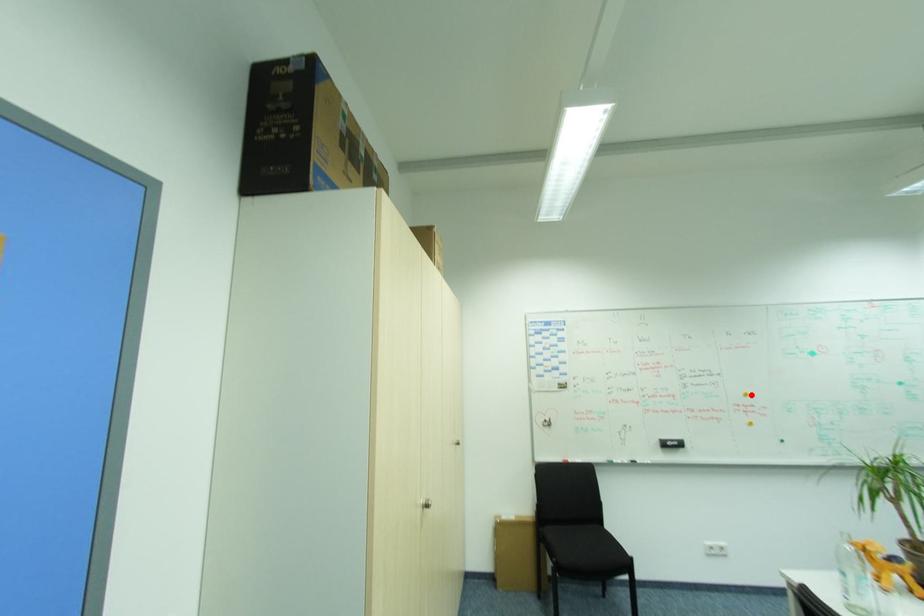
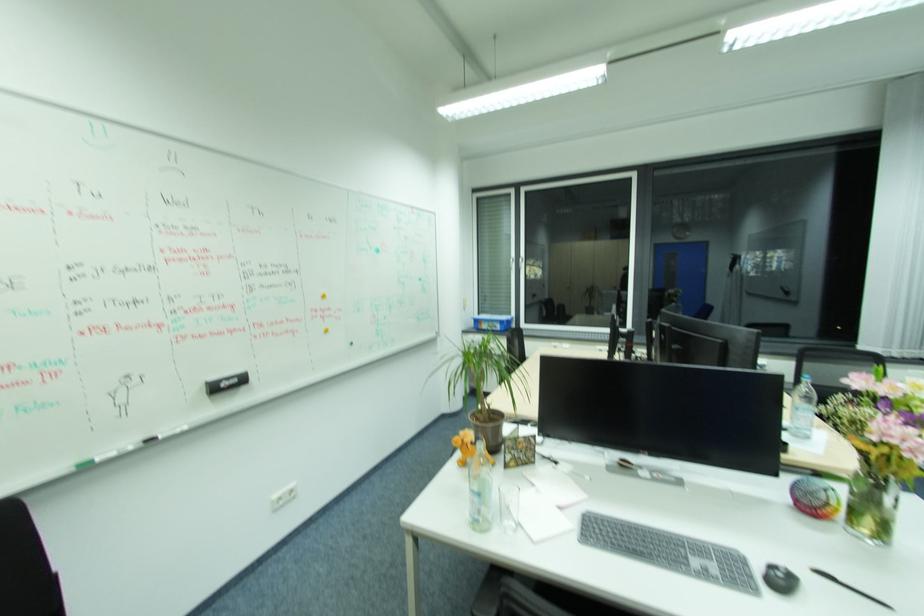
The point at the highlighted location is marked in the first image. Where is the corresponding point in the second image?

(329, 296)